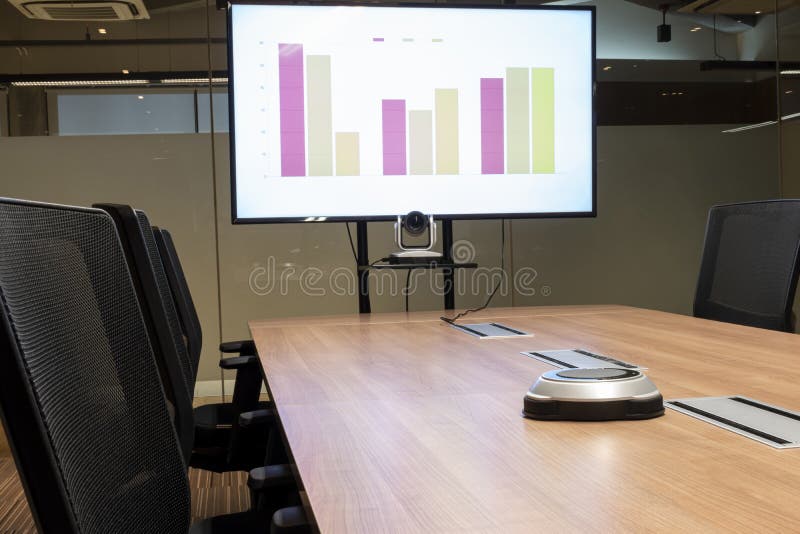
Where is `sheets`? sheets is located at coordinates (477, 333).